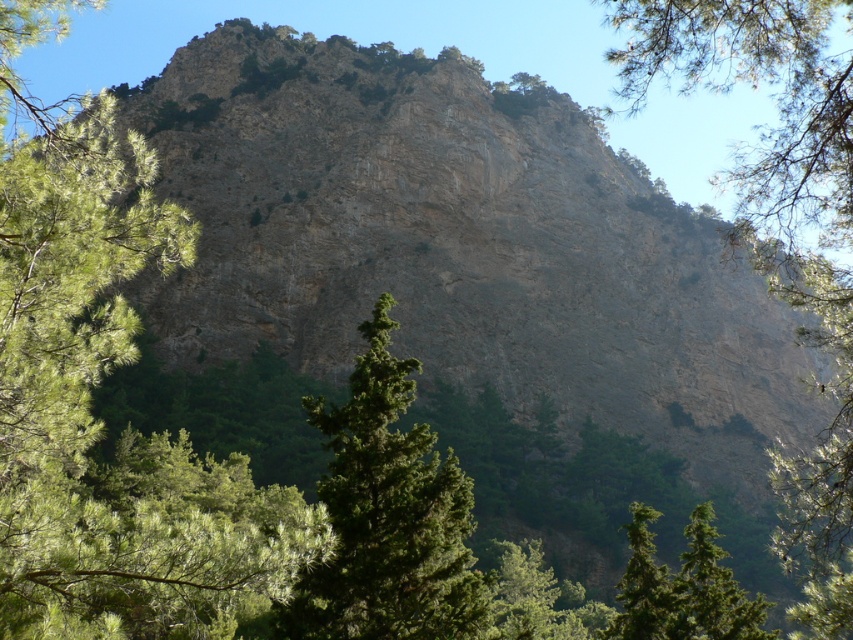
Question: In this image, where is green leafy tree at left located relative to green textured tree at center?

Choices:
 (A) below
 (B) above

Answer: (B)

Question: Which is nearer to the green leafy tree at upper right?

Choices:
 (A) green leafy tree at left
 (B) green textured tree at center

Answer: (B)

Question: Is green leafy tree at left wider than green textured tree at center?

Choices:
 (A) no
 (B) yes

Answer: (B)

Question: Which point is closer to the camera?

Choices:
 (A) (74, 556)
 (B) (389, 561)

Answer: (A)

Question: Which point is closer to the camera?

Choices:
 (A) green leafy tree at upper right
 (B) green leafy tree at left

Answer: (B)

Question: Does green leafy tree at left have a larger size compared to green leafy tree at upper right?

Choices:
 (A) yes
 (B) no

Answer: (B)